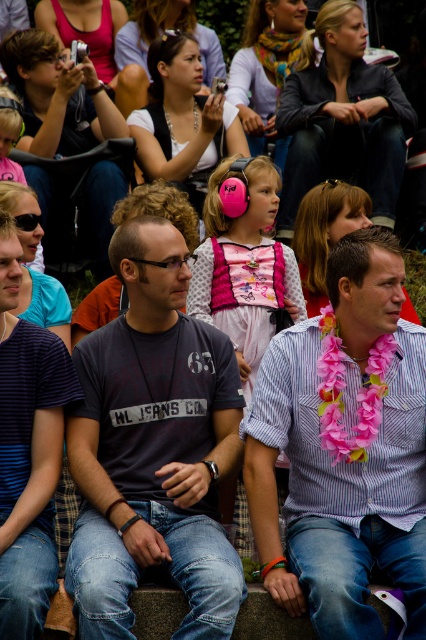
Which is more to the right, dark gray t-shirt at center or pink fabric lei at center?

From the viewer's perspective, pink fabric lei at center appears more on the right side.

Who is positioned more to the left, dark gray t-shirt at center or pink fabric lei at center?

From the viewer's perspective, dark gray t-shirt at center appears more on the left side.

This screenshot has width=426, height=640. I want to click on dark gray t-shirt at center, so point(152,448).